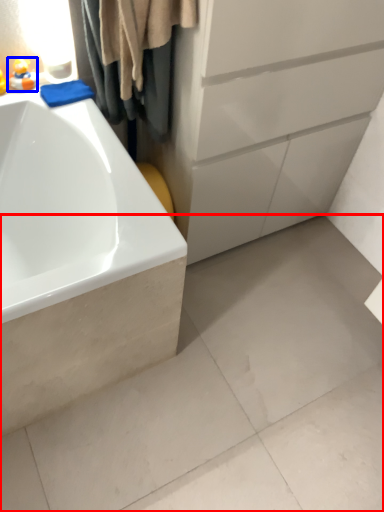
Question: Which of the following is the closest to the observer, concrete (highlighted by a red box) or toy (highlighted by a blue box)?

Choices:
 (A) concrete
 (B) toy

Answer: (A)